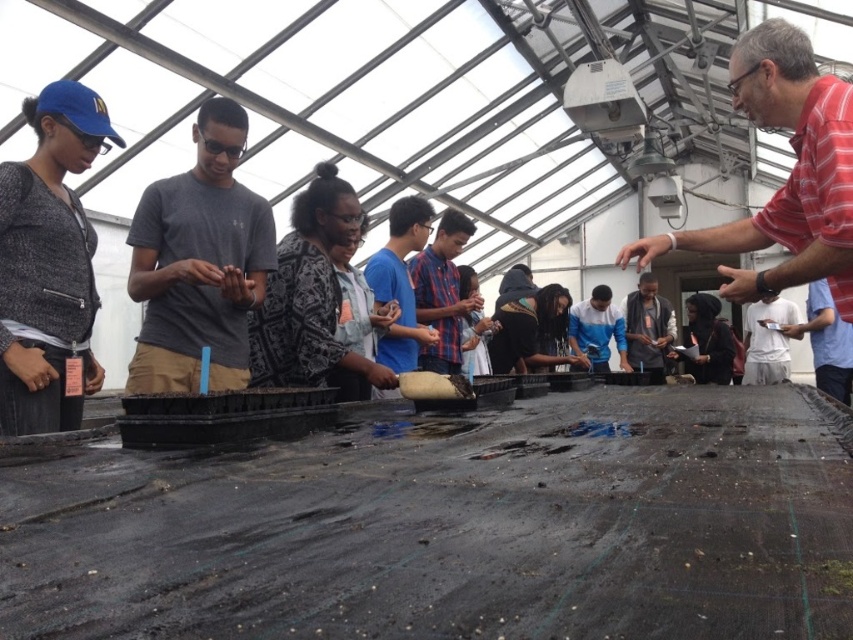
Question: Does matte black jacket at left appear on the left side of striped cotton shirt at upper right?

Choices:
 (A) no
 (B) yes

Answer: (B)

Question: Which of the following is the farthest from the observer?

Choices:
 (A) (689, 337)
 (B) (68, 404)

Answer: (A)

Question: Which of the following is the farthest from the observer?

Choices:
 (A) striped cotton shirt at upper right
 (B) dark gray shirt at center

Answer: (B)

Question: Does matte black jacket at left appear on the right side of striped cotton shirt at upper right?

Choices:
 (A) no
 (B) yes

Answer: (A)

Question: Which of the following is the farthest from the observer?

Choices:
 (A) gray matte t-shirt at center
 (B) striped cotton shirt at upper right

Answer: (A)

Question: Is blue cotton shirt at center to the left of dark gray shirt at center from the viewer's perspective?

Choices:
 (A) no
 (B) yes

Answer: (B)